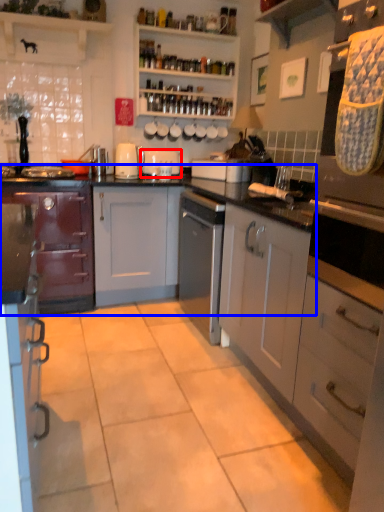
Question: Which object is further to the camera taking this photo, appliance (highlighted by a red box) or cabinetry (highlighted by a blue box)?

Choices:
 (A) appliance
 (B) cabinetry

Answer: (A)